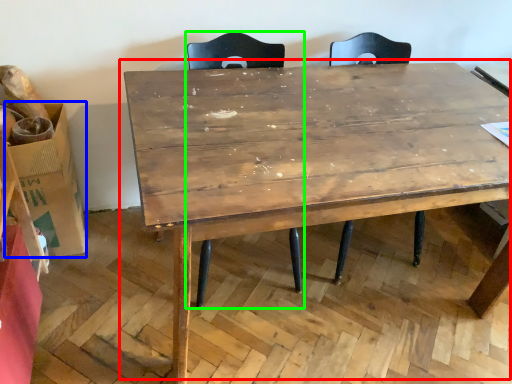
Question: Estimate the real-world distances between objects in this image. Which object is farther from table (highlighted by a red box), cardboard box (highlighted by a blue box) or swivel chair (highlighted by a green box)?

Choices:
 (A) cardboard box
 (B) swivel chair

Answer: (A)